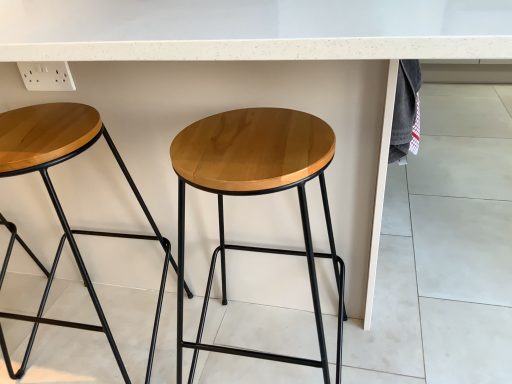
Identify the location of empty space that is ontop of natural wood stool at center, which is the first stool from right to left (from a real-world perspective). 252,144.